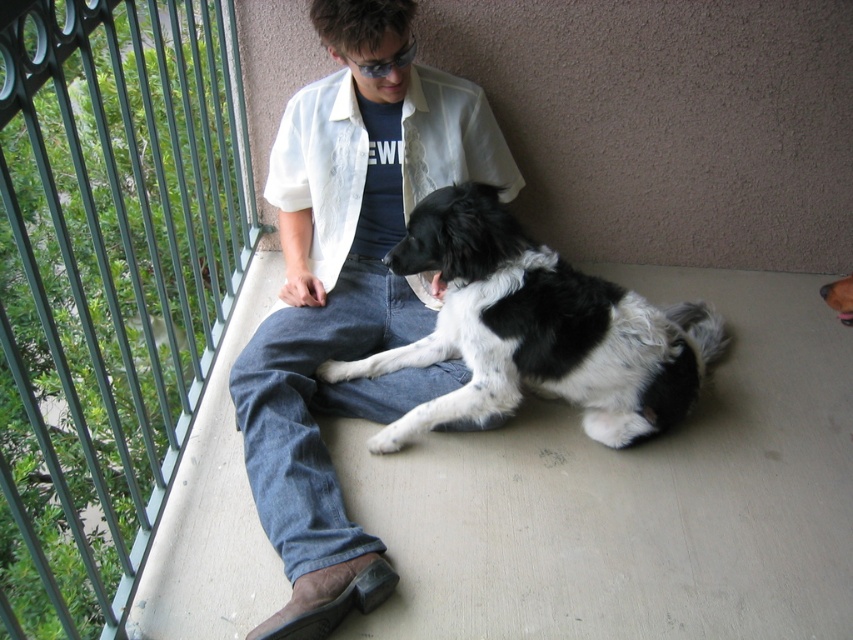
Question: Which point is farther to the camera?

Choices:
 (A) [187, 68]
 (B) [387, 74]

Answer: (A)

Question: Which object appears closest to the camera in this image?

Choices:
 (A) white cotton shirt at center
 (B) green metal fence at left
 (C) black and white fur dog at center

Answer: (B)

Question: Is white cotton shirt at center wider than black and white fur dog at center?

Choices:
 (A) no
 (B) yes

Answer: (A)

Question: Estimate the real-world distances between objects in this image. Which object is closer to the white cotton shirt at center?

Choices:
 (A) black and white fur dog at center
 (B) green metal fence at left

Answer: (A)

Question: Can you confirm if green metal fence at left is thinner than black and white fur dog at center?

Choices:
 (A) yes
 (B) no

Answer: (B)

Question: Is green metal fence at left positioned before black and white fur dog at center?

Choices:
 (A) yes
 (B) no

Answer: (A)